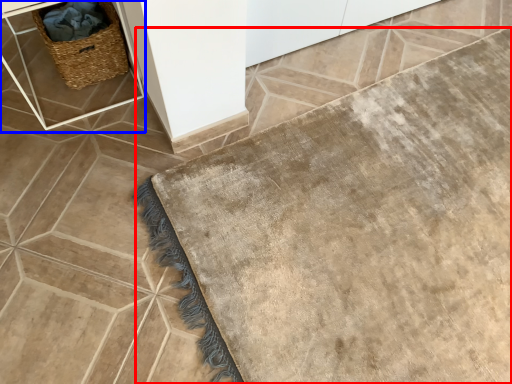
Question: Which object is further to the camera taking this photo, bath mat (highlighted by a red box) or table (highlighted by a blue box)?

Choices:
 (A) bath mat
 (B) table

Answer: (B)